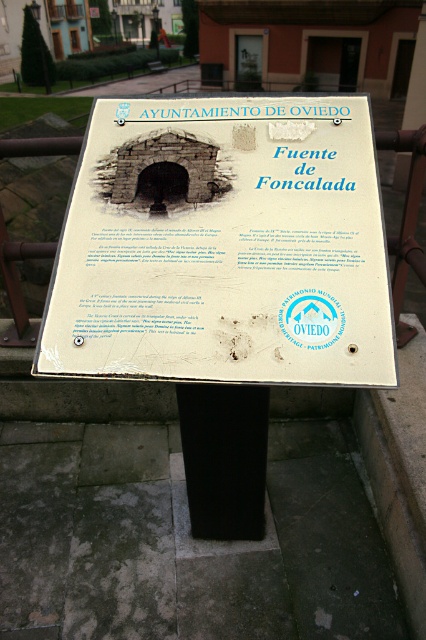
You are a city planner assessing the placement of the white plastic sign at center and the black matte pole at center. Based on their sizes, which object would require more horizontal space if they were to be moved to a narrower area?

The white plastic sign at center has a larger width than the black matte pole at center, so it would require more horizontal space if moved to a narrower area.

You are a maintenance worker who needs to replace a part on the black matte pole at center. The part requires a tool that is 60 centimeters long. Can you safely use the tool while standing next to the white plastic sign at center without the tool hitting the sign?

The distance between the white plastic sign at center and the black matte pole at center is 56.85 centimeters. Since the tool is 60 centimeters long, it would extend beyond the 56.85 centimeter gap, so the tool might hit the sign when used. Therefore, you cannot safely use the tool without risking contact with the sign.

You are a city planner reviewing the placement of the white plastic sign at center and the black matte pole at center. Based on the scene, which object is taller?

The white plastic sign at center is taller than the black matte pole at center according to the description.